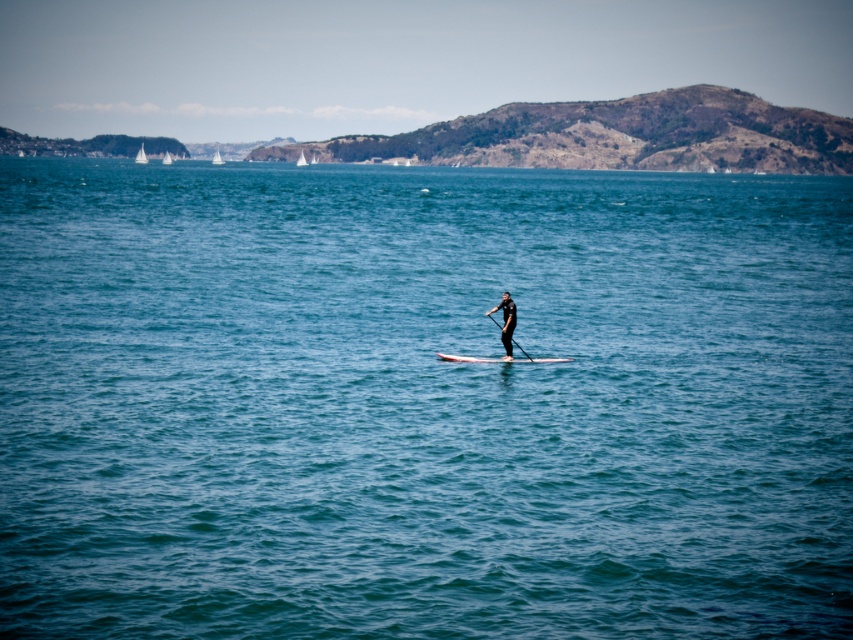
Does white foam surfboard at center have a greater height compared to white glossy paddleboard at center?

In fact, white foam surfboard at center may be shorter than white glossy paddleboard at center.

What do you see at coordinates (500, 358) in the screenshot?
I see `white foam surfboard at center` at bounding box center [500, 358].

The height and width of the screenshot is (640, 853). What do you see at coordinates (500, 358) in the screenshot? I see `white foam surfboard at center` at bounding box center [500, 358].

Locate an element on the screen. This screenshot has width=853, height=640. white foam surfboard at center is located at coordinates point(500,358).